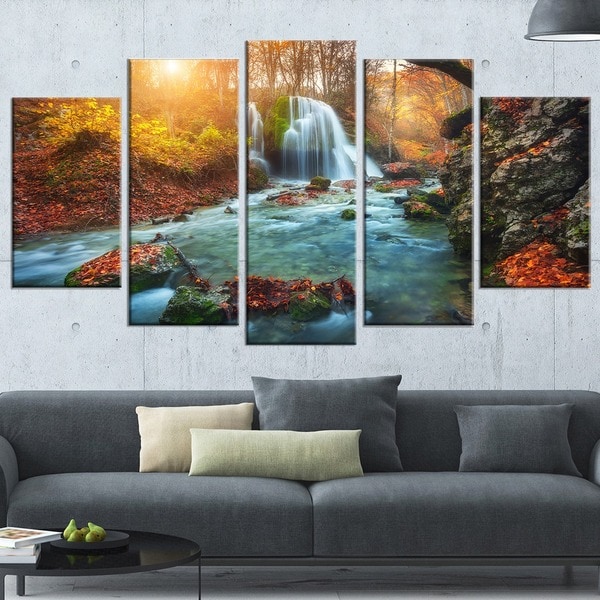
What are the coordinates of `light` in the screenshot? It's located at (541, 16).